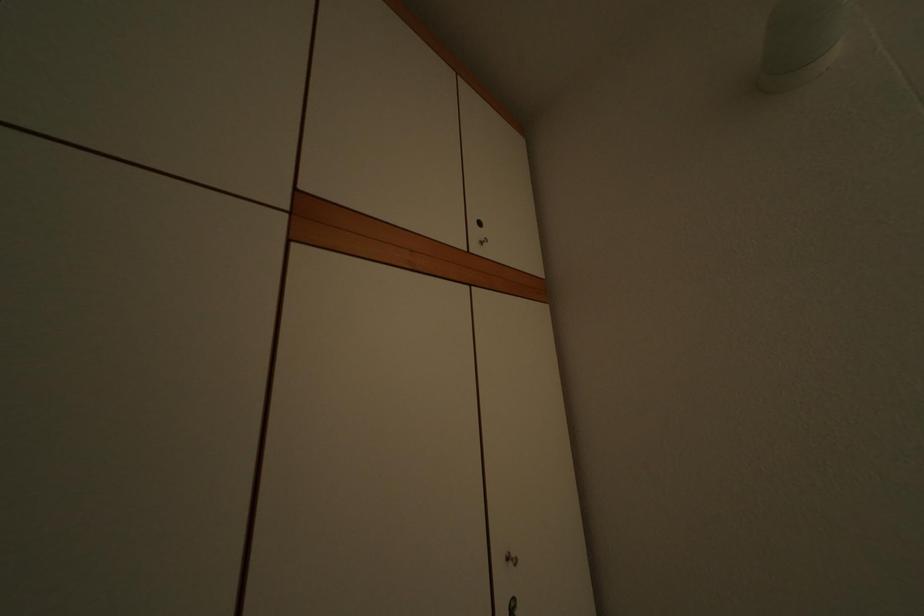
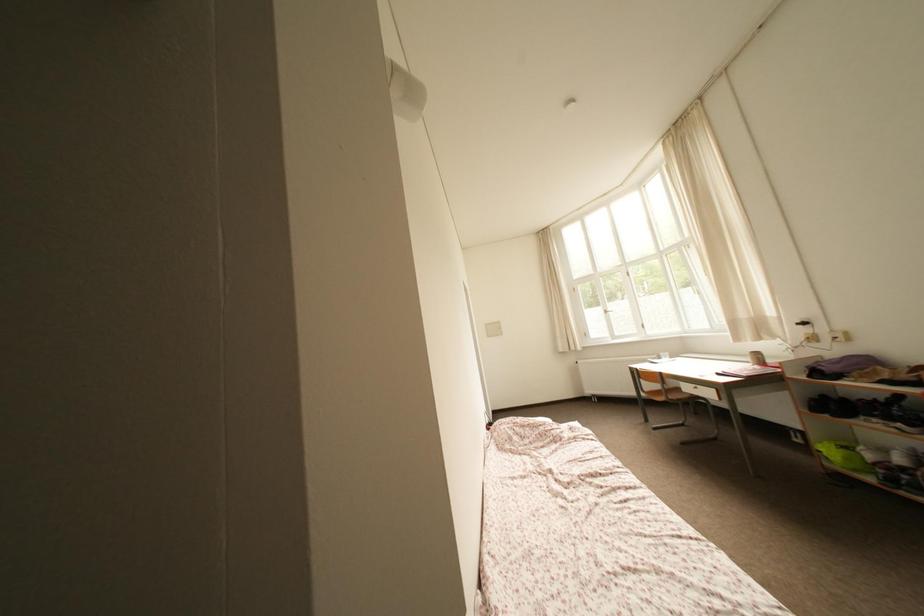
Question: How did the camera likely rotate?

Choices:
 (A) Left
 (B) Right
 (C) Up
 (D) Down

Answer: (B)